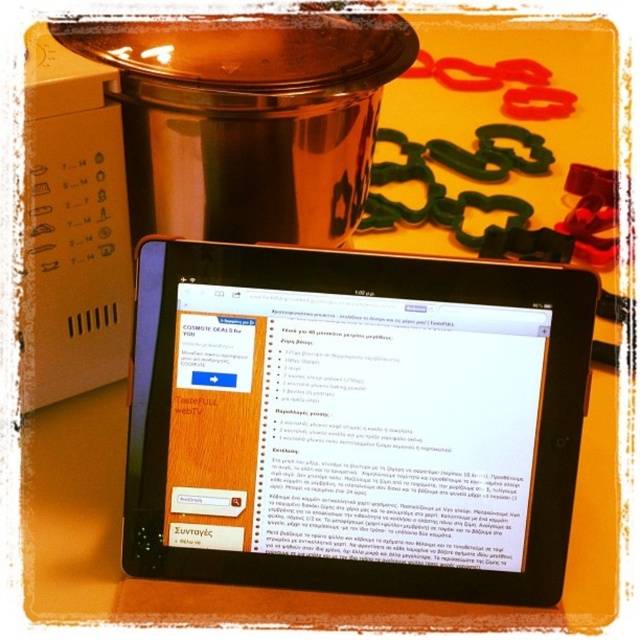
You are holding a 12 inch ruler and want to measure the distance between yourself and the black glossy tablet at center. Approximately how many rulers would you need to span the distance?

The distance between you and the black glossy tablet at center is 35.60 inches. Since each ruler is 12 inches long, you would need approximately 3 rulers to span the distance, as 3 rulers would cover 36 inches, which is just over the required 35.60 inches.

You are a delivery person who just arrived at a house. You need to place a package on a surface that is above the black glossy tablet at center but below the white plastic microwave at left. Is there enough space between them to place the package?

The black glossy tablet at center is positioned under the white plastic microwave at left, so there is space between them. However, since the tablet is directly under the microwave, placing a package between them might not be feasible due to the vertical alignment. Consider placing the package elsewhere on the table or a different surface.